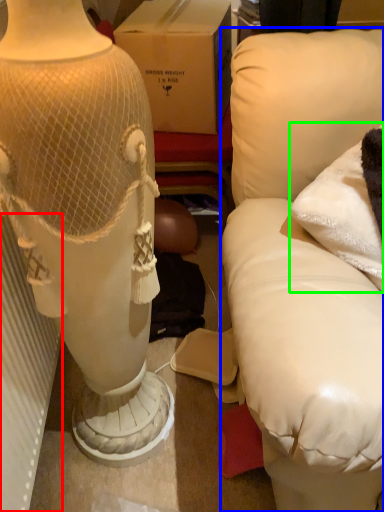
Question: Estimate the real-world distances between objects in this image. Which object is closer to radiator (highlighted by a red box), furniture (highlighted by a blue box) or pillow (highlighted by a green box)?

Choices:
 (A) furniture
 (B) pillow

Answer: (A)